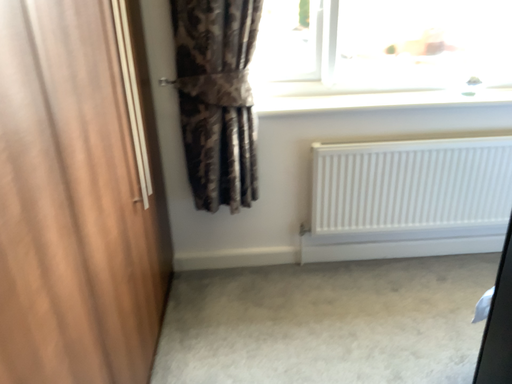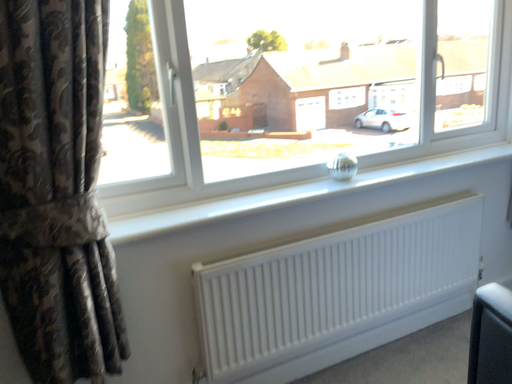
Question: How did the camera likely rotate when shooting the video?

Choices:
 (A) rotated downward
 (B) rotated upward

Answer: (B)